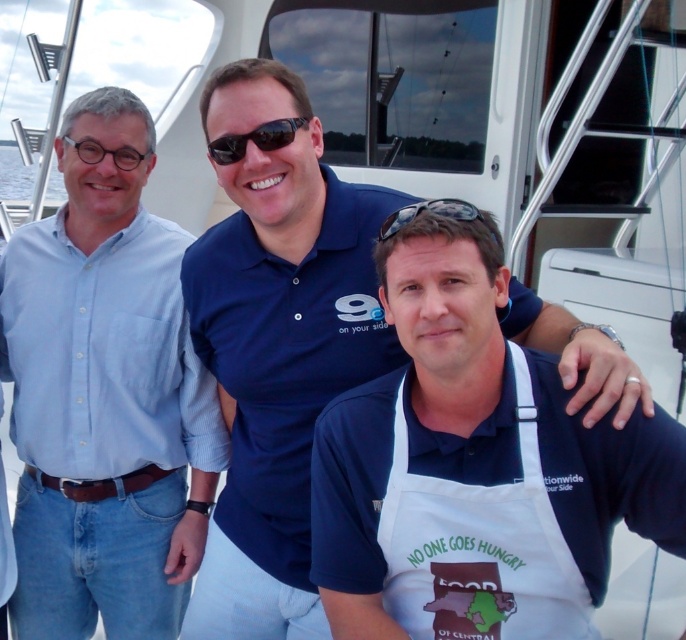
You are a photographer trying to capture a group photo of the three men on the boat deck. You notice the white apron at center and the black reflective sunglasses at center. Which object should you avoid placing in the foreground to prevent blocking the men? Explain your reasoning.

The white apron at center is much taller than the black reflective sunglasses at center. Therefore, you should avoid placing the white apron at center in the foreground because it is taller and could block the men more effectively than the sunglasses.

You are on a boat deck and need to locate the white apron at center. Based on the coordinates provided, where would you find it?

The white apron at center is located at the coordinates point [473,467].